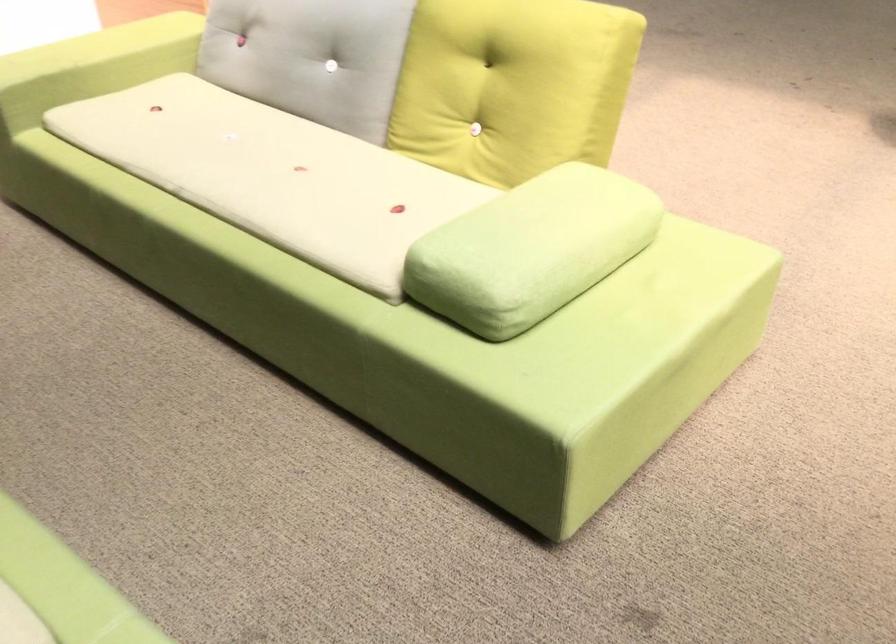
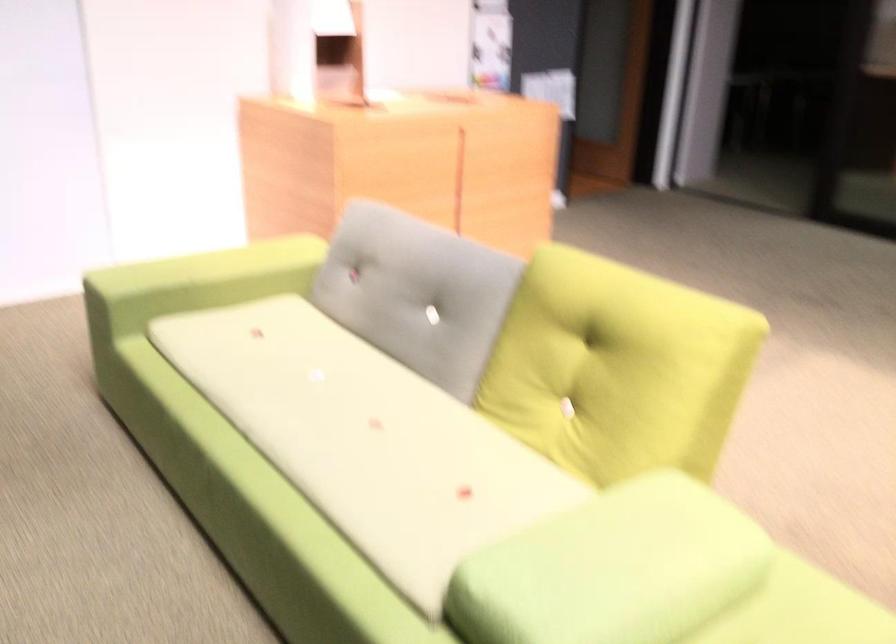
In the second image, find the point that corresponds to [536,234] in the first image.

(613, 569)